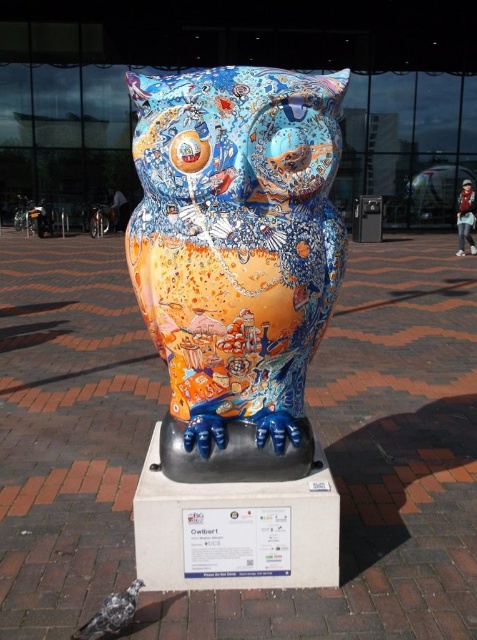
Question: Which object is farther from the camera taking this photo?

Choices:
 (A) speckled gray pigeon at lower left
 (B) painted ceramic owl at center

Answer: (A)

Question: Does painted ceramic owl at center have a greater width compared to speckled gray pigeon at lower left?

Choices:
 (A) yes
 (B) no

Answer: (A)

Question: Is painted ceramic owl at center closer to the viewer compared to speckled gray pigeon at lower left?

Choices:
 (A) no
 (B) yes

Answer: (B)

Question: Does painted ceramic owl at center have a larger size compared to speckled gray pigeon at lower left?

Choices:
 (A) yes
 (B) no

Answer: (A)

Question: Among these objects, which one is farthest from the camera?

Choices:
 (A) painted ceramic owl at center
 (B) speckled gray pigeon at lower left

Answer: (B)